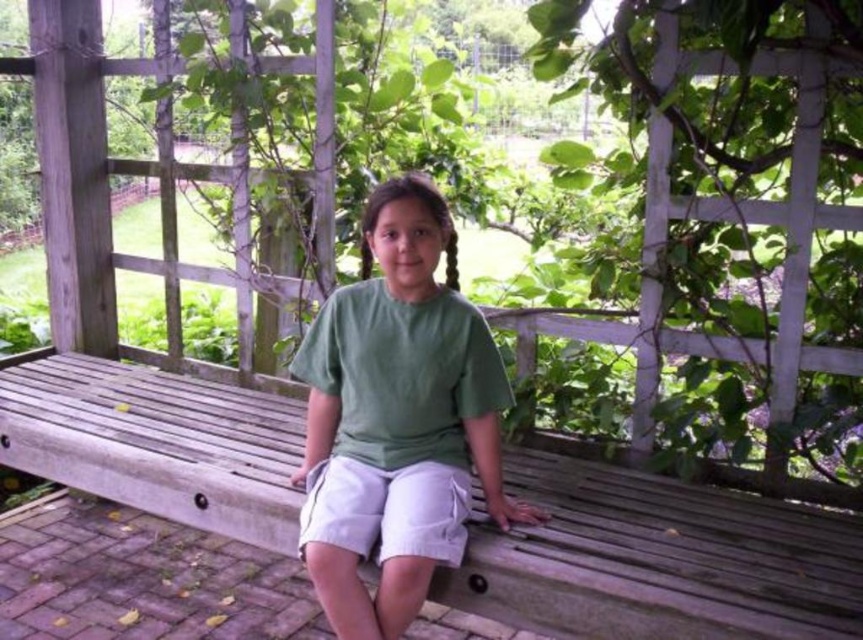
You are a painter standing at the edge of a garden. You need to paint a scene where the wooden bench at center and the green cotton shirt at center are both visible. Which object should you focus on first if you want to paint the taller one first?

The green cotton shirt at center is taller than the wooden bench at center, so you should focus on painting the green cotton shirt at center first.

You are standing in a park and see a wooden bench at center and a green cotton shirt at center. Which object is positioned more to the left?

The wooden bench at center is positioned more to the left than the green cotton shirt at center.

You are trying to place a new decorative pillow that is 1 meter wide on the wooden bench at center. Given the green cotton shirt at center is already on the bench, can the pillow fit alongside it?

The wooden bench at center might be wider than green cotton shirt at center, so there might be enough space for the pillow to fit alongside the green cotton shirt at center.